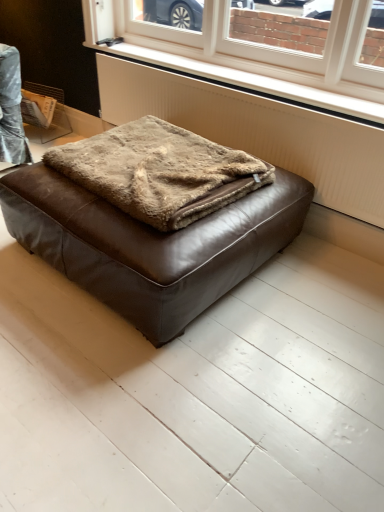
Identify the location of free space in front of brown leather ottoman at center. (173, 388).